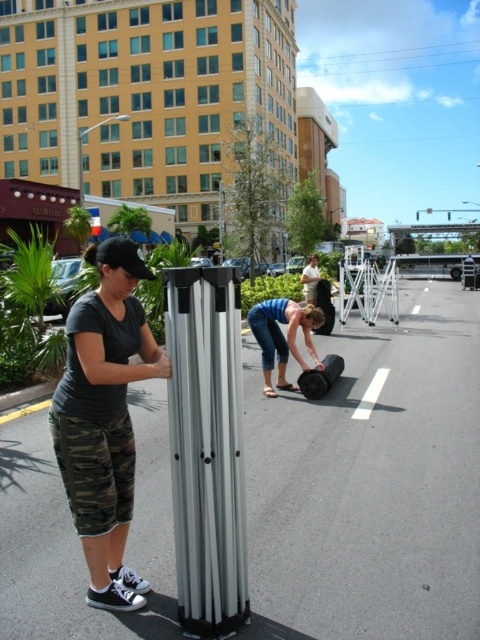
Can you confirm if camo pants at lower left is taller than white matte shirt at center?

No, camo pants at lower left is not taller than white matte shirt at center.

Describe the element at coordinates (104, 419) in the screenshot. Image resolution: width=480 pixels, height=640 pixels. I see `camo pants at lower left` at that location.

This screenshot has width=480, height=640. Identify the location of camo pants at lower left. (104, 419).

Which is in front, point (267, 300) or point (305, 284)?

Point (305, 284)

Is point (307, 326) more distant than point (307, 282)?

No.

Image resolution: width=480 pixels, height=640 pixels. Find the location of `blue denim jeans at lower center`. blue denim jeans at lower center is located at coordinates (283, 337).

Does camo pants at lower left appear over blue denim jeans at lower center?

No, camo pants at lower left is not above blue denim jeans at lower center.

Which is behind, point (118, 563) or point (275, 312)?

The point (275, 312) is more distant.

What do you see at coordinates (104, 419) in the screenshot? I see `camo pants at lower left` at bounding box center [104, 419].

Find the location of `camo pants at lower left`. camo pants at lower left is located at coordinates (104, 419).